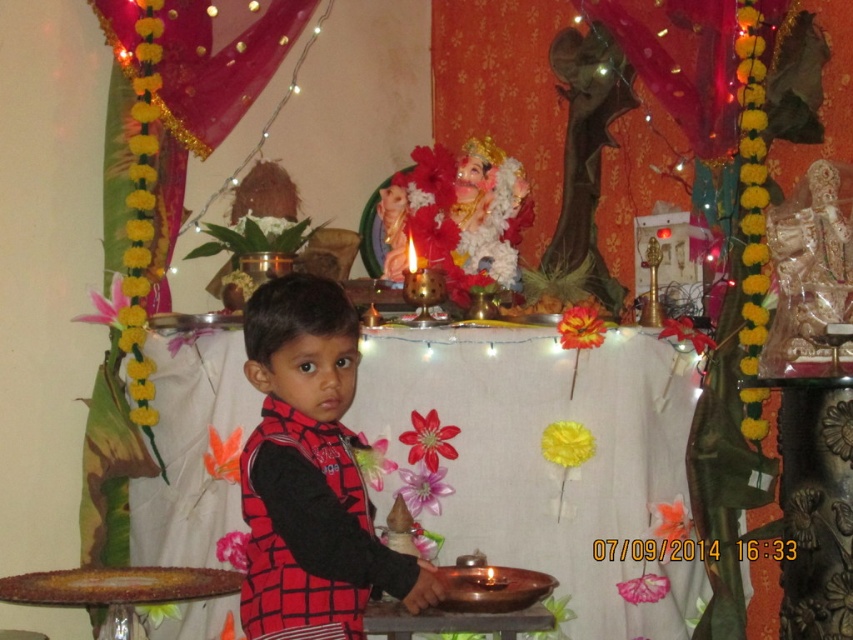
Is metallic brown tray at center closer to the viewer compared to red checkered vest at center?

That is False.

Locate an element on the screen. Image resolution: width=853 pixels, height=640 pixels. metallic brown tray at center is located at coordinates (544, 464).

This screenshot has width=853, height=640. What do you see at coordinates (544, 464) in the screenshot?
I see `metallic brown tray at center` at bounding box center [544, 464].

Where is `metallic brown tray at center`? metallic brown tray at center is located at coordinates (544, 464).